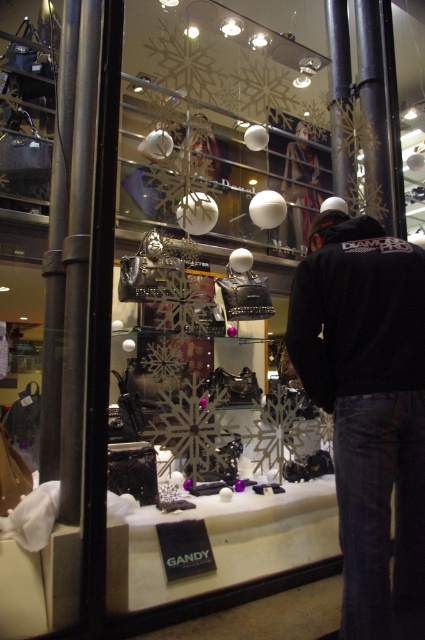
Question: Where is black cotton sweatshirt at center located in relation to matte black jacket at center in the image?

Choices:
 (A) left
 (B) right

Answer: (A)

Question: Is black fleece jacket at center thinner than matte black jacket at center?

Choices:
 (A) no
 (B) yes

Answer: (B)

Question: Does black fleece jacket at center come behind matte black jacket at center?

Choices:
 (A) yes
 (B) no

Answer: (B)

Question: Among these points, which one is farthest from the camera?

Choices:
 (A) (367, 276)
 (B) (396, 618)

Answer: (A)

Question: Which object is the farthest from the black cotton sweatshirt at center?

Choices:
 (A) matte black jacket at center
 (B) black fleece jacket at center

Answer: (A)

Question: Which point is closer to the camera?

Choices:
 (A) (317, 157)
 (B) (424, 333)
 (C) (334, 376)

Answer: (B)